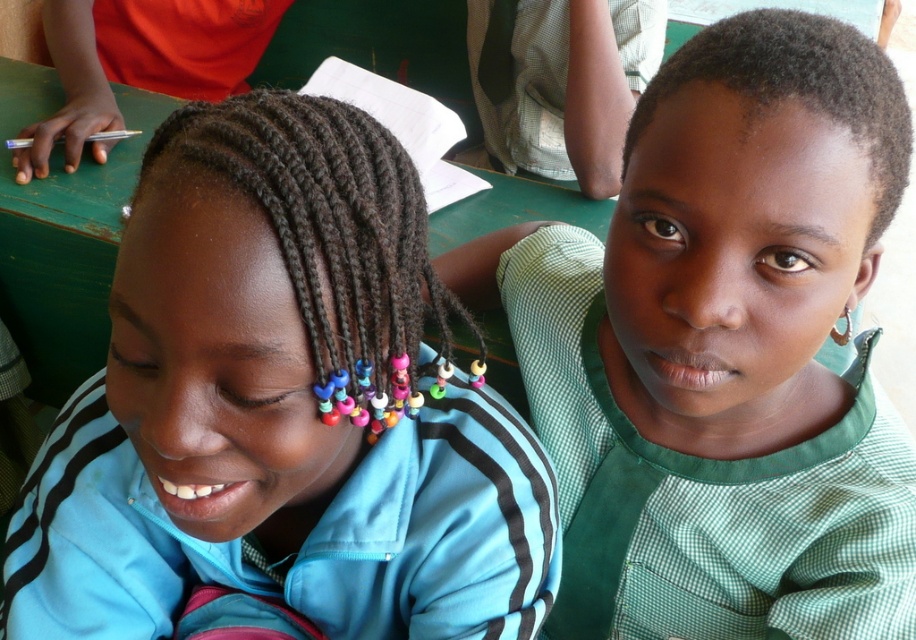
You are standing in front of the classroom scene. There is a point at coordinates (722, 349). Which object from the scene is located exactly at this point?

The green checkered shirt at upper right is located exactly at point (722, 349).